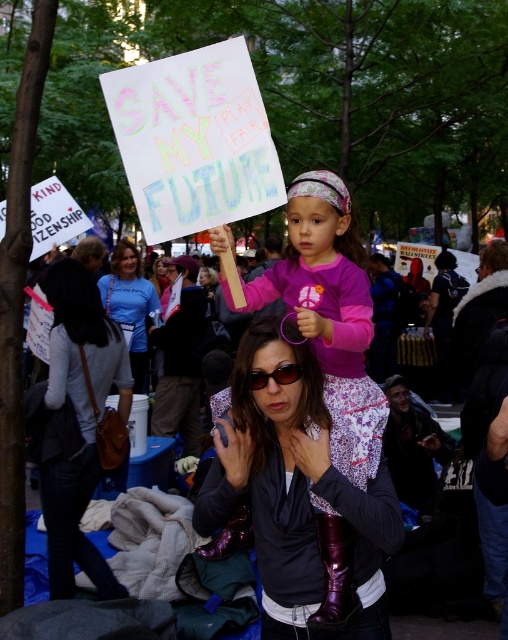
Does point (73, 506) lie behind point (441, 413)?

That is False.

Can you confirm if gray fabric jacket at center is wider than pink fabric at center?

In fact, gray fabric jacket at center might be narrower than pink fabric at center.

The height and width of the screenshot is (640, 508). Describe the element at coordinates (77, 422) in the screenshot. I see `gray fabric jacket at center` at that location.

Locate an element on the screen. The image size is (508, 640). gray fabric jacket at center is located at coordinates (77, 422).

Looking at this image, is pink matte shirt at center to the left of blue t-shirt at center from the viewer's perspective?

In fact, pink matte shirt at center is to the right of blue t-shirt at center.

Does pink matte shirt at center have a greater height compared to blue t-shirt at center?

In fact, pink matte shirt at center may be shorter than blue t-shirt at center.

Where is `pink matte shirt at center`? The width and height of the screenshot is (508, 640). pink matte shirt at center is located at coordinates (331, 316).

Measure the distance between pink fabric at center and matte black sunglasses at center.

pink fabric at center is 3.70 meters from matte black sunglasses at center.

Between pink fabric at center and matte black sunglasses at center, which one is positioned lower?

pink fabric at center is below.

Who is more distant from viewer, (444,624) or (252,378)?

The point (444,624) is behind.

The height and width of the screenshot is (640, 508). I want to click on pink fabric at center, so click(443, 628).